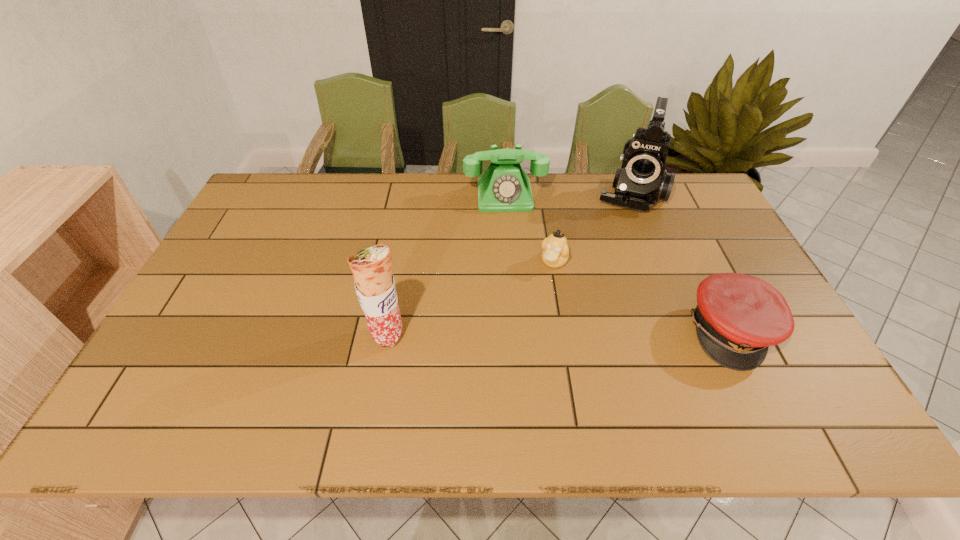
Identify the location of burrito. (374, 283).

Where is `cap`? This screenshot has width=960, height=540. cap is located at coordinates (738, 316).

Locate an element on the screen. Image resolution: width=960 pixels, height=540 pixels. telephone is located at coordinates (504, 187).

This screenshot has height=540, width=960. I want to click on duckling, so click(555, 254).

The image size is (960, 540). In order to click on camcorder in this screenshot , I will do `click(642, 180)`.

Where is `vacant point located on the right of the leftmost object`? The image size is (960, 540). vacant point located on the right of the leftmost object is located at coordinates (467, 335).

Identify the location of vacant space located on the dial of the telephone. pyautogui.click(x=509, y=228).

Identify the location of free spot located on the dial of the telephone. (514, 279).

This screenshot has width=960, height=540. I want to click on free space located on the dial of the telephone, so click(508, 226).

I want to click on free space located on the face of the duckling, so click(x=534, y=299).